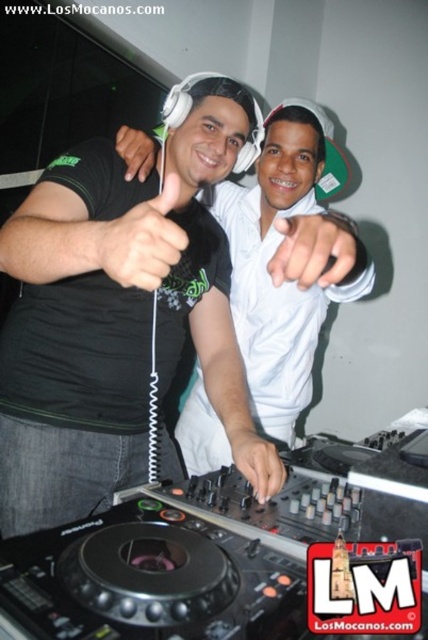
Question: Can you confirm if matte black hand at center is positioned to the right of white matte hand at center?

Choices:
 (A) yes
 (B) no

Answer: (B)

Question: Is matte black headphones at center positioned in front of matte black hand at center?

Choices:
 (A) no
 (B) yes

Answer: (A)

Question: Which is farther from the matte black headphones at center?

Choices:
 (A) black matte hand at center
 (B) matte black hand at center

Answer: (A)

Question: Which object appears closest to the camera in this image?

Choices:
 (A) black matte hand at center
 (B) matte black headphones at center
 (C) matte black hand at center
 (D) matte black hand at upper center

Answer: (C)

Question: Which point is closer to the camera?

Choices:
 (A) matte black hand at upper center
 (B) white matte hand at center

Answer: (B)

Question: From the image, what is the correct spatial relationship of matte black hand at center in relation to white matte hand at center?

Choices:
 (A) left
 (B) right

Answer: (A)